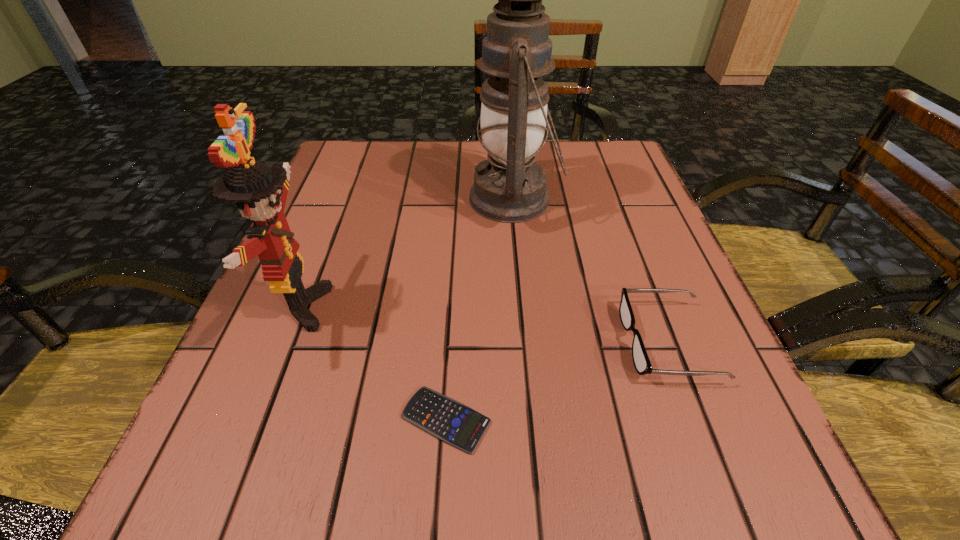
Where is `free region at the left edge of the desktop`? This screenshot has width=960, height=540. free region at the left edge of the desktop is located at coordinates (366, 237).

Locate an element on the screen. This screenshot has height=540, width=960. blank space at the far left corner of the desktop is located at coordinates (388, 190).

The width and height of the screenshot is (960, 540). In the image, there is a desktop. What are the coordinates of `vacant space at the near left corner` in the screenshot? It's located at (236, 461).

Where is `free location at the far right corner of the desktop`? free location at the far right corner of the desktop is located at coordinates (630, 166).

Locate an element on the screen. free space at the near right corner of the desktop is located at coordinates (794, 500).

Where is `free point between the spectacles and the nutcracker`? The image size is (960, 540). free point between the spectacles and the nutcracker is located at coordinates (484, 325).

This screenshot has height=540, width=960. Find the location of `unoccupied area between the farthest object and the third tallest object`. unoccupied area between the farthest object and the third tallest object is located at coordinates (590, 271).

Find the location of a particular element. The width and height of the screenshot is (960, 540). free area in between the spectacles and the second tallest object is located at coordinates (484, 325).

The height and width of the screenshot is (540, 960). I want to click on vacant point located between the leftmost object and the nearest object, so click(373, 363).

Image resolution: width=960 pixels, height=540 pixels. Find the location of `blank region between the calculator and the second tallest object`. blank region between the calculator and the second tallest object is located at coordinates (373, 363).